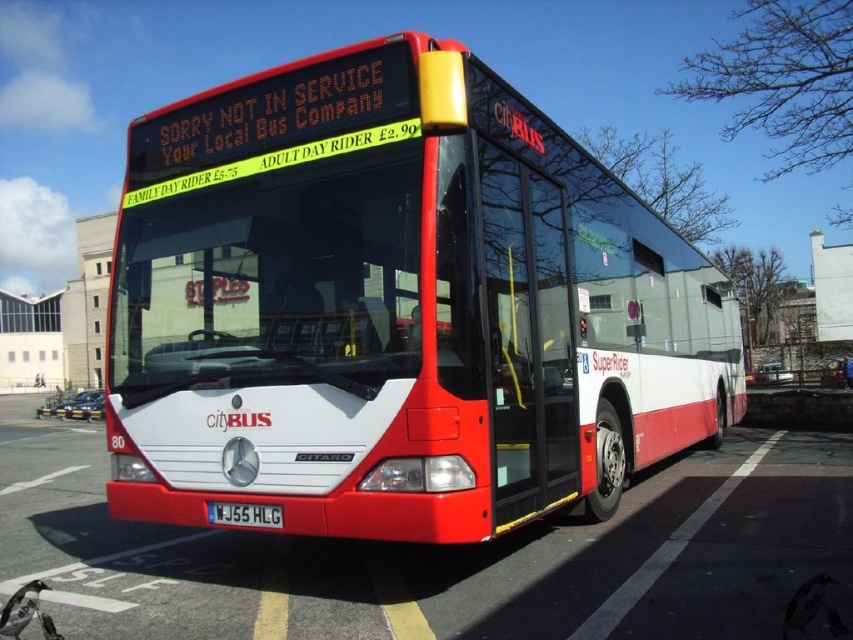
Question: Which of the following is the farthest from the observer?

Choices:
 (A) white glossy bus at center
 (B) matte white bus at center
 (C) black plastic license plate at center

Answer: (C)

Question: Is matte white bus at center positioned in front of white glossy bus at center?

Choices:
 (A) yes
 (B) no

Answer: (B)

Question: Does white glossy bus at center lie in front of black plastic license plate at center?

Choices:
 (A) no
 (B) yes

Answer: (B)

Question: Which point is farther to the camera?

Choices:
 (A) white glossy bus at center
 (B) matte white bus at center

Answer: (B)

Question: Does white glossy bus at center have a larger size compared to black plastic license plate at center?

Choices:
 (A) no
 (B) yes

Answer: (B)

Question: Which point appears farthest from the camera in this image?

Choices:
 (A) (260, 522)
 (B) (648, 580)

Answer: (B)